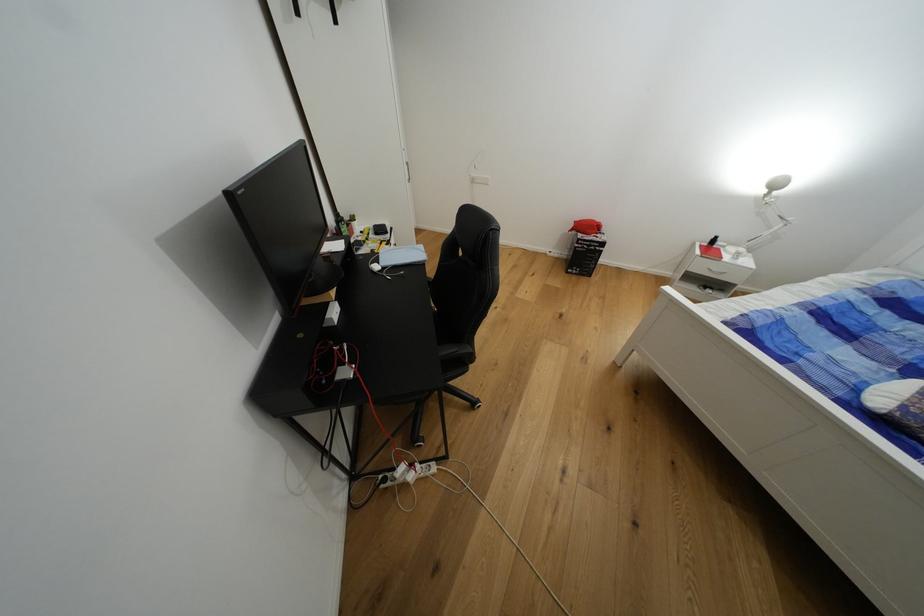
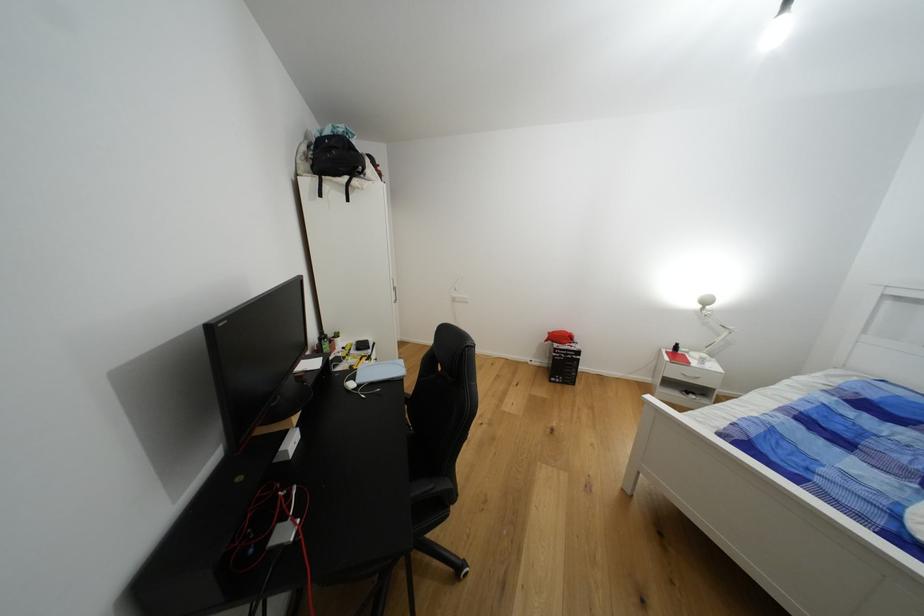
The images are taken continuously from a first-person perspective. In which direction are you moving?

The cameraman moved toward right, backward.